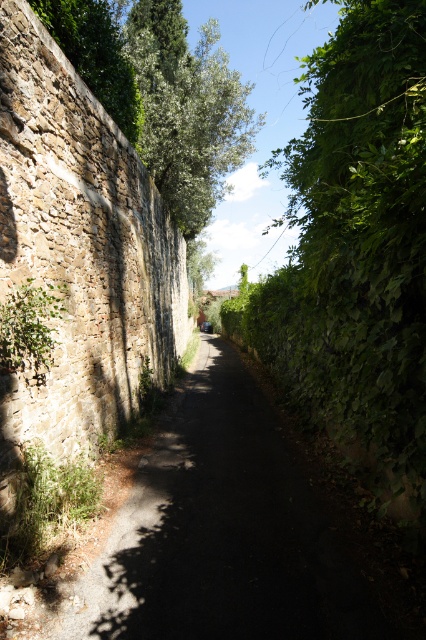
Question: Estimate the real-world distances between objects in this image. Which object is farther from the dark gray metallic car at center?

Choices:
 (A) dark asphalt path at center
 (B) green rough stone wall at upper left

Answer: (A)

Question: In this image, where is green leafy hedge at right located relative to green leafy tree at upper center?

Choices:
 (A) left
 (B) right

Answer: (B)

Question: Can you confirm if dark asphalt path at center is wider than green rough stone wall at upper left?

Choices:
 (A) yes
 (B) no

Answer: (A)

Question: Which of the following is the farthest from the observer?

Choices:
 (A) (132, 492)
 (B) (88, 42)
 (C) (129, 51)

Answer: (C)

Question: Which is farther from the dark asphalt path at center?

Choices:
 (A) dark gray metallic car at center
 (B) green leafy tree at upper center
 (C) green leafy hedge at right

Answer: (A)

Question: Is the position of dark asphalt path at center less distant than that of green leafy hedge at right?

Choices:
 (A) yes
 (B) no

Answer: (B)